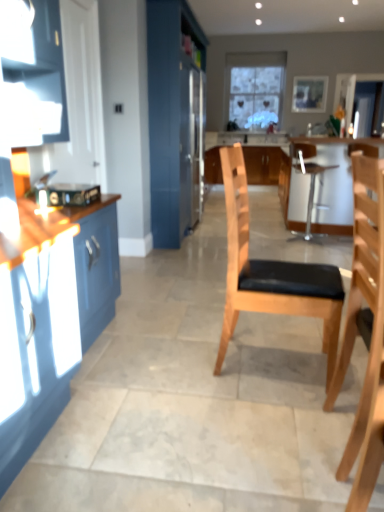
Locate an element on the screen. The image size is (384, 512). vacant space behind natural wood chair at center, marked as the first chair in a front-to-back arrangement is located at coordinates (314, 400).